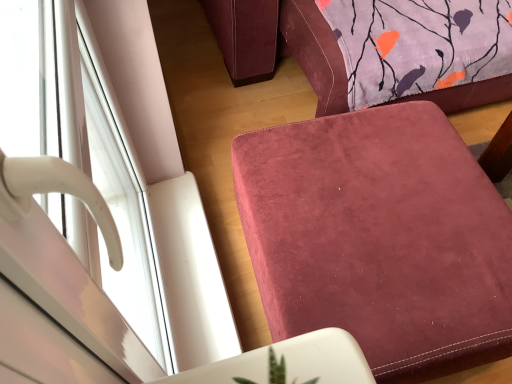
Question: From the image's perspective, is white glossy window handle at left on suede-like burgundy ottoman at lower right?

Choices:
 (A) yes
 (B) no

Answer: (A)

Question: Is white glossy window handle at left placed right next to suede-like burgundy ottoman at lower right?

Choices:
 (A) yes
 (B) no

Answer: (B)

Question: Is white glossy window handle at left oriented away from suede-like burgundy ottoman at lower right?

Choices:
 (A) yes
 (B) no

Answer: (B)

Question: Considering the relative sizes of white glossy window handle at left and suede-like burgundy ottoman at lower right in the image provided, is white glossy window handle at left thinner than suede-like burgundy ottoman at lower right?

Choices:
 (A) no
 (B) yes

Answer: (B)

Question: Is the depth of white glossy window handle at left greater than that of suede-like burgundy ottoman at lower right?

Choices:
 (A) no
 (B) yes

Answer: (A)

Question: From a real-world perspective, does white glossy window handle at left stand above suede-like burgundy ottoman at lower right?

Choices:
 (A) yes
 (B) no

Answer: (A)

Question: Does suede-like burgundy ottoman at lower right have a greater height compared to white glossy window handle at left?

Choices:
 (A) yes
 (B) no

Answer: (B)

Question: Is suede-like burgundy ottoman at lower right to the right of white glossy window handle at left from the viewer's perspective?

Choices:
 (A) yes
 (B) no

Answer: (A)

Question: Is suede-like burgundy ottoman at lower right far away from white glossy window handle at left?

Choices:
 (A) no
 (B) yes

Answer: (A)

Question: Is suede-like burgundy ottoman at lower right smaller than white glossy window handle at left?

Choices:
 (A) no
 (B) yes

Answer: (A)

Question: From a real-world perspective, is suede-like burgundy ottoman at lower right located higher than white glossy window handle at left?

Choices:
 (A) no
 (B) yes

Answer: (A)

Question: Does suede-like burgundy ottoman at lower right turn towards white glossy window handle at left?

Choices:
 (A) no
 (B) yes

Answer: (A)

Question: Considering the positions of white glossy window handle at left and suede-like burgundy ottoman at lower right in the image, is white glossy window handle at left taller or shorter than suede-like burgundy ottoman at lower right?

Choices:
 (A) tall
 (B) short

Answer: (A)